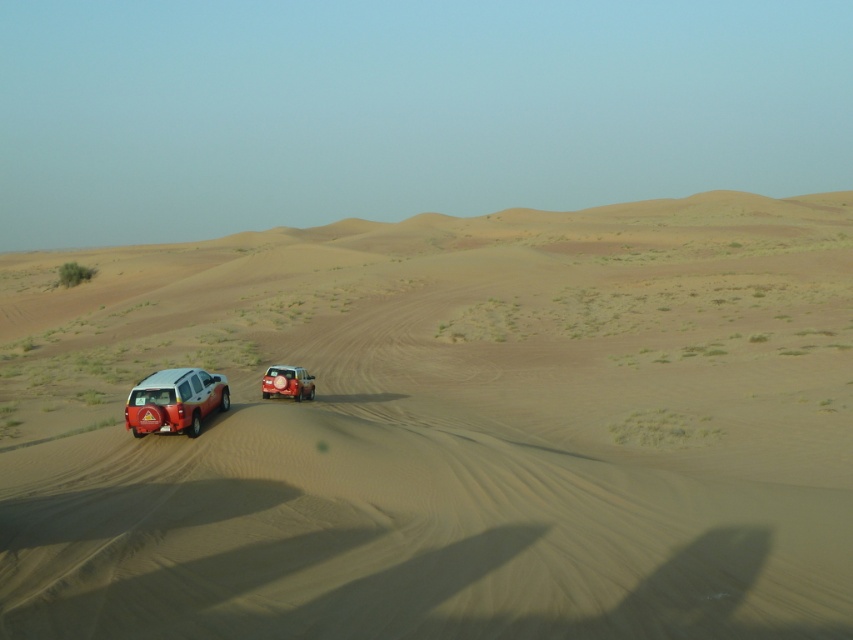
You are standing at the edge of the desert and want to take a photo of both the matte white suv at lower left and the metallic silver suv at center. Which vehicle should you focus on first to ensure both are in the frame?

You should focus on the matte white suv at lower left first because it is closer to you than the metallic silver suv at center, so adjusting the camera to include both would require starting with the closer one.